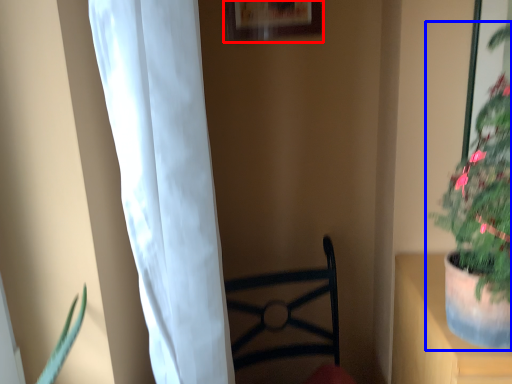
Question: Which of the following is the farthest to the observer, picture frame (highlighted by a red box) or houseplant (highlighted by a blue box)?

Choices:
 (A) picture frame
 (B) houseplant

Answer: (A)